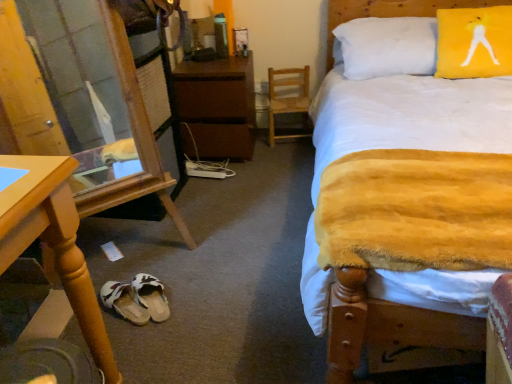
Identify the location of free point to the right of white fabric sandals at lower center, placed as the second footwear when sorted from right to left. (185, 302).